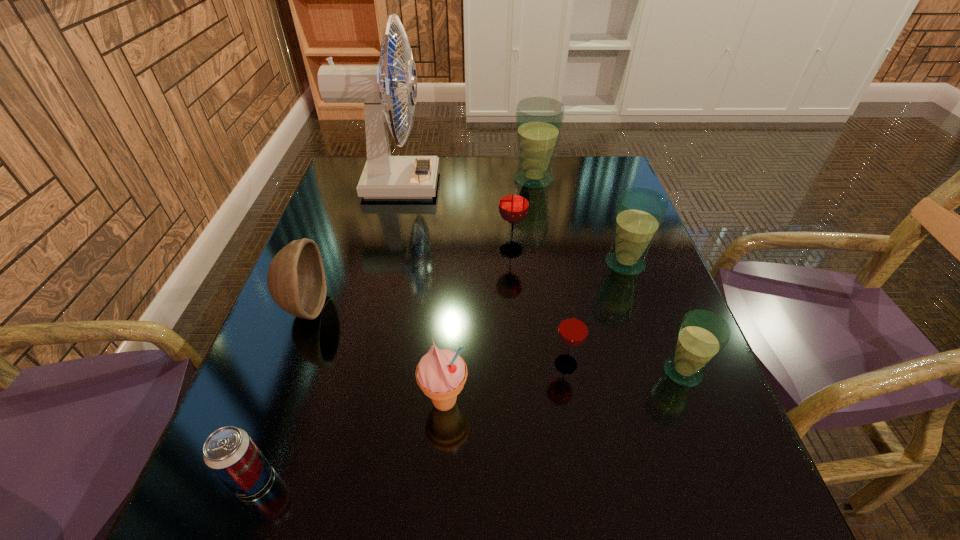
Find the location of a particular element. blue fan is located at coordinates (384, 176).

The width and height of the screenshot is (960, 540). In order to click on fan in this screenshot , I will do `click(384, 176)`.

At what (x,y) coordinates should I click in order to perform the action: click on the biggest blue glass. Please return your answer as a coordinate pair (x, y). This screenshot has height=540, width=960. Looking at the image, I should click on (539, 120).

Find the location of a particular element. The image size is (960, 540). the tallest glass is located at coordinates (539, 120).

Where is `the bigger red glass`? the bigger red glass is located at coordinates (513, 206).

Find the location of `the left red glass`. the left red glass is located at coordinates click(513, 206).

This screenshot has width=960, height=540. In order to click on the second farthest blue glass in this screenshot , I will do `click(640, 212)`.

Find the location of `bowl`. bowl is located at coordinates (296, 281).

Find the location of a particular element. The width and height of the screenshot is (960, 540). the sixth object from right to left is located at coordinates (441, 374).

Where is `the nearest blue glass`? This screenshot has width=960, height=540. the nearest blue glass is located at coordinates (702, 334).